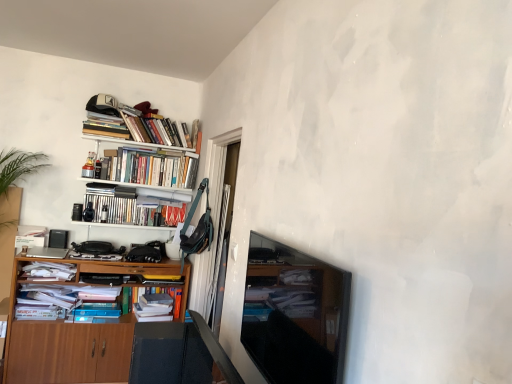
Question: Is wooden cabinet at left smaller than hardcover books at upper left, marked as the 4th book in a top-to-bottom arrangement?

Choices:
 (A) no
 (B) yes

Answer: (A)

Question: From the image's perspective, is wooden cabinet at left on top of hardcover books at upper left, which is the 2th book from bottom to top?

Choices:
 (A) no
 (B) yes

Answer: (A)

Question: Considering the relative sizes of wooden cabinet at left and hardcover books at upper left, marked as the 4th book in a top-to-bottom arrangement, in the image provided, is wooden cabinet at left taller than hardcover books at upper left, marked as the 4th book in a top-to-bottom arrangement,?

Choices:
 (A) no
 (B) yes

Answer: (B)

Question: Is wooden cabinet at left oriented away from hardcover books at upper left, marked as the 4th book in a top-to-bottom arrangement?

Choices:
 (A) no
 (B) yes

Answer: (A)

Question: From a real-world perspective, is wooden cabinet at left located higher than hardcover books at upper left, marked as the 4th book in a top-to-bottom arrangement?

Choices:
 (A) yes
 (B) no

Answer: (B)

Question: Looking at the image, does matte black tv at center seem bigger or smaller compared to hardcover books at upper left, which is counted as the fifth book, starting from the bottom?

Choices:
 (A) big
 (B) small

Answer: (A)

Question: From a real-world perspective, is matte black tv at center physically located above or below hardcover books at upper left, the first book when ordered from top to bottom?

Choices:
 (A) below
 (B) above

Answer: (A)

Question: Is matte black tv at center inside the boundaries of hardcover books at upper left, the first book when ordered from top to bottom, or outside?

Choices:
 (A) inside
 (B) outside

Answer: (B)

Question: From the image's perspective, is matte black tv at center positioned above or below hardcover books at upper left, the first book when ordered from top to bottom?

Choices:
 (A) above
 (B) below

Answer: (B)

Question: In terms of height, does wooden cabinet at left look taller or shorter compared to hardcover books at upper left, which is counted as the fifth book, starting from the bottom?

Choices:
 (A) short
 (B) tall

Answer: (B)

Question: Is wooden cabinet at left to the left or to the right of hardcover books at upper left, which is counted as the fifth book, starting from the bottom, in the image?

Choices:
 (A) left
 (B) right

Answer: (A)

Question: From the image's perspective, relative to hardcover books at upper left, the first book when ordered from top to bottom, is wooden cabinet at left above or below?

Choices:
 (A) below
 (B) above

Answer: (A)

Question: Which is correct: wooden cabinet at left is inside hardcover books at upper left, which is counted as the fifth book, starting from the bottom, or outside of it?

Choices:
 (A) inside
 (B) outside

Answer: (B)

Question: In the image, is wooden cabinet at left on the left side or the right side of hardcover books at upper left, marked as the 4th book in a top-to-bottom arrangement?

Choices:
 (A) left
 (B) right

Answer: (A)

Question: In terms of size, does wooden cabinet at left appear bigger or smaller than hardcover books at upper left, marked as the 4th book in a top-to-bottom arrangement?

Choices:
 (A) big
 (B) small

Answer: (A)